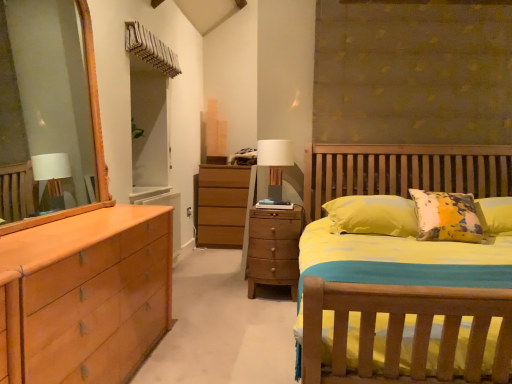
Question: Considering the positions of point (257, 160) and point (250, 248), is point (257, 160) closer or farther from the camera than point (250, 248)?

Choices:
 (A) closer
 (B) farther

Answer: (B)

Question: From a real-world perspective, is white fabric-covered table lamp at center above or below matte brown chest of drawers at center?

Choices:
 (A) below
 (B) above

Answer: (B)

Question: Is white fabric-covered table lamp at center to the left or to the right of matte brown chest of drawers at center in the image?

Choices:
 (A) left
 (B) right

Answer: (A)

Question: Considering the positions of point (254, 215) and point (275, 170), is point (254, 215) closer or farther from the camera than point (275, 170)?

Choices:
 (A) farther
 (B) closer

Answer: (B)

Question: In terms of width, does matte brown chest of drawers at center look wider or thinner when compared to white fabric-covered table lamp at center?

Choices:
 (A) thin
 (B) wide

Answer: (B)

Question: Is matte brown chest of drawers at center to the left or to the right of white fabric-covered table lamp at center in the image?

Choices:
 (A) left
 (B) right

Answer: (B)

Question: From the image's perspective, relative to white fabric-covered table lamp at center, is matte brown chest of drawers at center above or below?

Choices:
 (A) above
 (B) below

Answer: (B)